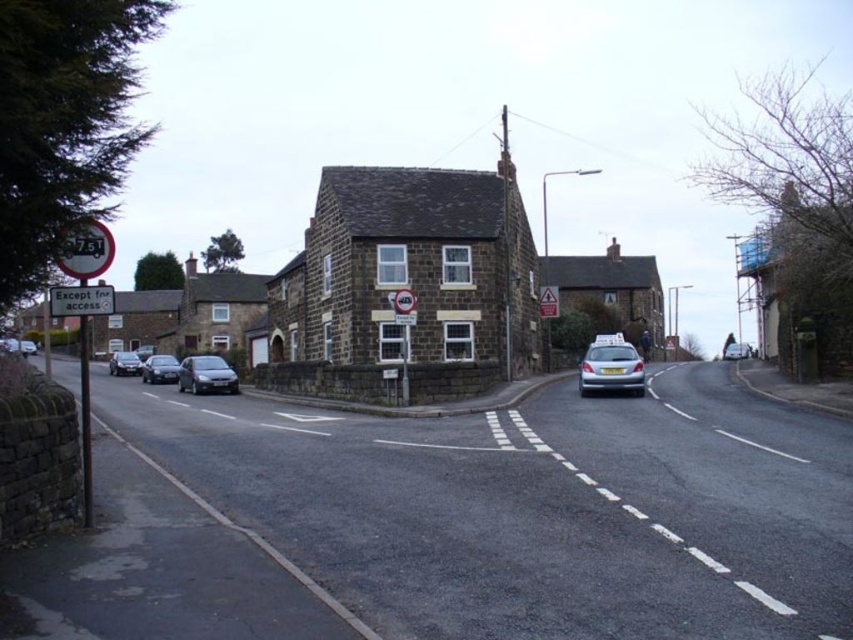
Can you confirm if matte black car at left is positioned to the left of white plastic sign at center?

Indeed, matte black car at left is positioned on the left side of white plastic sign at center.

Measure the distance between matte black car at left and camera.

They are 170.34 feet apart.

The width and height of the screenshot is (853, 640). Identify the location of matte black car at left. (125, 364).

Find the location of a particular element. Image resolution: width=853 pixels, height=640 pixels. matte black car at left is located at coordinates (125, 364).

Is silver metallic car at right to the right of matte black car at center from the viewer's perspective?

Correct, you'll find silver metallic car at right to the right of matte black car at center.

Does silver metallic car at right have a larger size compared to matte black car at center?

Yes.

Between point (735, 346) and point (27, 339), which one is positioned in front?

Point (735, 346) is more forward.

The height and width of the screenshot is (640, 853). I want to click on silver metallic car at right, so click(x=735, y=352).

Which is above, matte black car at left or metallic triangular warning sign at center?

metallic triangular warning sign at center is higher up.

Can you confirm if matte black car at left is taller than metallic triangular warning sign at center?

Correct, matte black car at left is much taller as metallic triangular warning sign at center.

Where is `matte black car at left`? The width and height of the screenshot is (853, 640). matte black car at left is located at coordinates (125, 364).

Identify the location of matte black car at left. The image size is (853, 640). (125, 364).